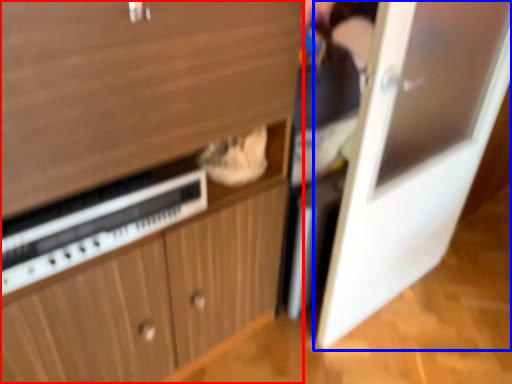
Question: Which point is closer to the camera, cabinetry (highlighted by a red box) or door (highlighted by a blue box)?

Choices:
 (A) cabinetry
 (B) door

Answer: (A)